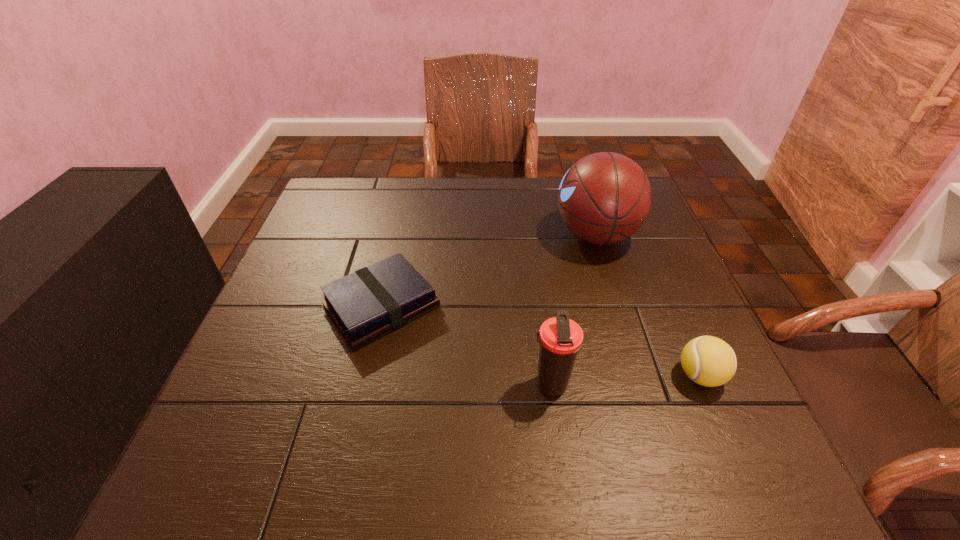
The height and width of the screenshot is (540, 960). Find the location of `free region located on the back of the leftmost object`. free region located on the back of the leftmost object is located at coordinates (407, 189).

Find the location of a particular element. The width and height of the screenshot is (960, 540). object that is at the far edge is located at coordinates (604, 198).

Identify the location of object present at the left edge. This screenshot has height=540, width=960. (365, 305).

In order to click on basketball that is positioned at the right edge in this screenshot , I will do `click(604, 198)`.

The width and height of the screenshot is (960, 540). I want to click on tennis ball that is positioned at the right edge, so click(709, 361).

This screenshot has height=540, width=960. In order to click on object located at the far right corner in this screenshot , I will do `click(604, 198)`.

Where is `vacant space at the far edge of the desktop`? This screenshot has height=540, width=960. vacant space at the far edge of the desktop is located at coordinates (525, 213).

This screenshot has width=960, height=540. In order to click on free space at the near edge of the desktop in this screenshot , I will do `click(379, 461)`.

The width and height of the screenshot is (960, 540). Identify the location of blank area at the left edge. (270, 361).

The height and width of the screenshot is (540, 960). Identify the location of vacant space at the right edge of the desktop. (653, 250).